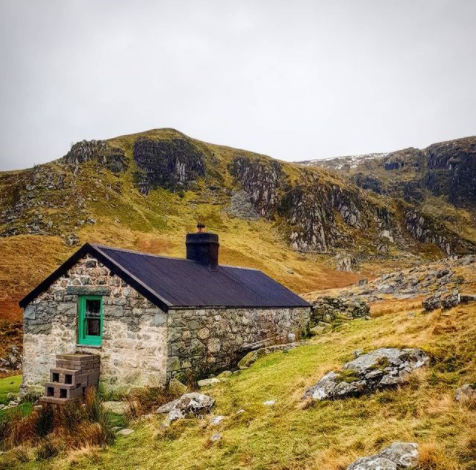
You are a GUI agent. You are given a task and a screenshot of the screen. Output one action in this format:
    pyautogui.click(x=<x>, y=<y>)
    Task: Click on the chimney
    Image resolution: width=476 pixels, height=470 pixels.
    Given the screenshot: What is the action you would take?
    pyautogui.click(x=198, y=249)